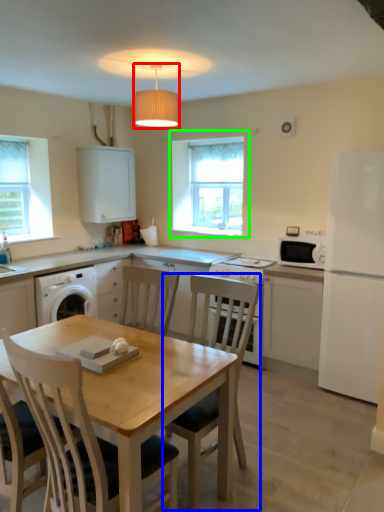
Question: Estimate the real-world distances between objects in this image. Which object is farther from lamp (highlighted by a red box), chair (highlighted by a blue box) or window (highlighted by a green box)?

Choices:
 (A) chair
 (B) window

Answer: (B)